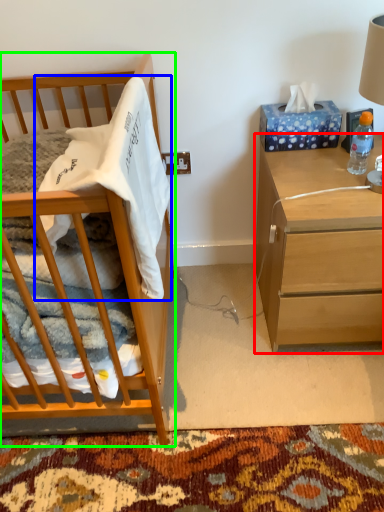
Question: Which object is positioned farthest from nightstand (highlighted by a red box)? Select from blanket (highlighted by a blue box) and cabinetry (highlighted by a green box).

Choices:
 (A) blanket
 (B) cabinetry

Answer: (B)